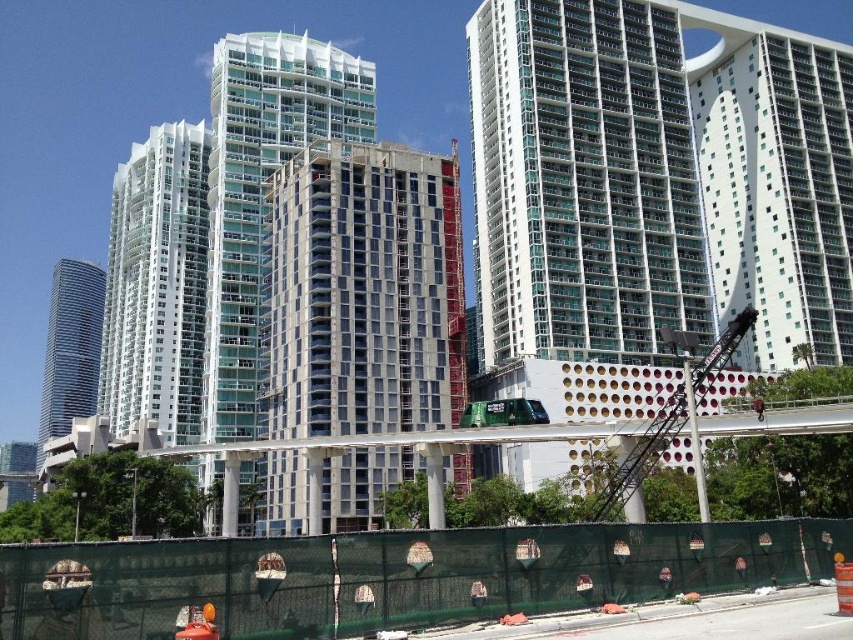
Question: Which point is farther to the camera?

Choices:
 (A) glassy concrete building at center
 (B) white glass building at center

Answer: (B)

Question: Is green mesh fence at lower center thinner than white glass building at center?

Choices:
 (A) yes
 (B) no

Answer: (A)

Question: Is white concrete building at center bigger than white glass building at center?

Choices:
 (A) yes
 (B) no

Answer: (B)

Question: Which point is farther from the camera taking this photo?

Choices:
 (A) (618, 61)
 (B) (345, 397)

Answer: (A)

Question: Which of the following is the closest to the observer?

Choices:
 (A) white glass building at center
 (B) white concrete building at center
 (C) transparent glass building at upper right

Answer: (B)

Question: Can you confirm if green mesh fence at lower center is thinner than shiny silver skyscraper at left?

Choices:
 (A) yes
 (B) no

Answer: (A)